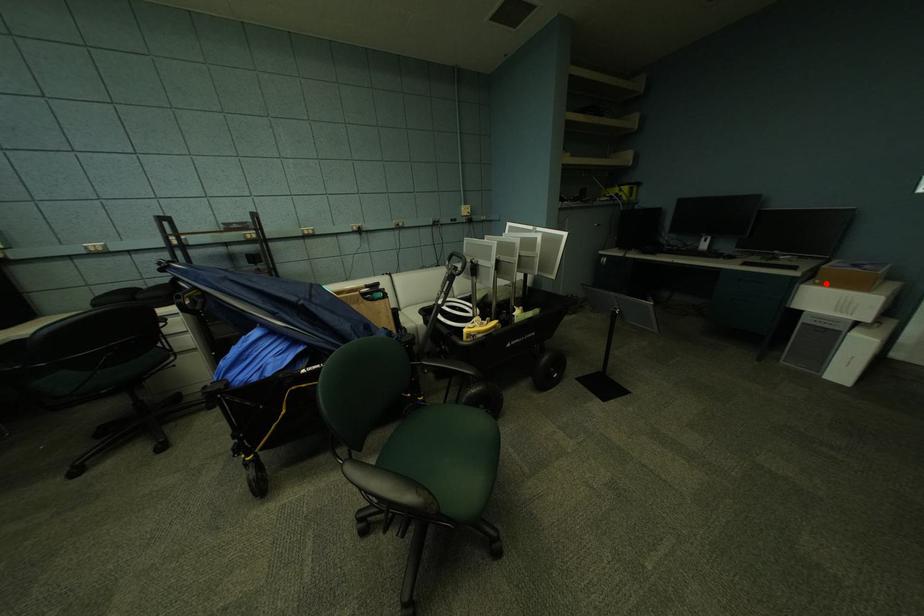
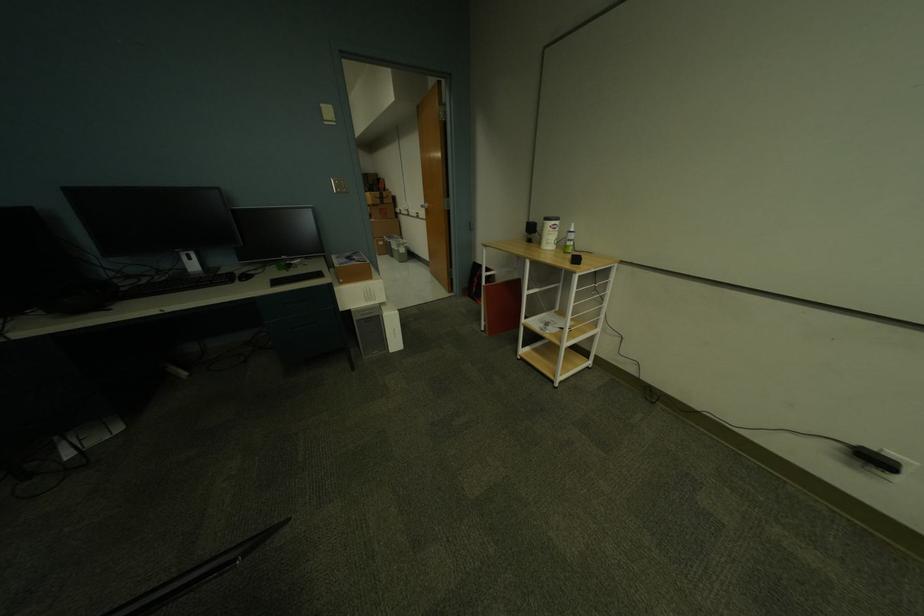
Question: I am providing you with two images of the same scene from different viewpoints. In image1, a red point is highlighted. Considering the same 3D point in image2, which of the following is correct?

Choices:
 (A) It is closer
 (B) It is farther

Answer: (A)